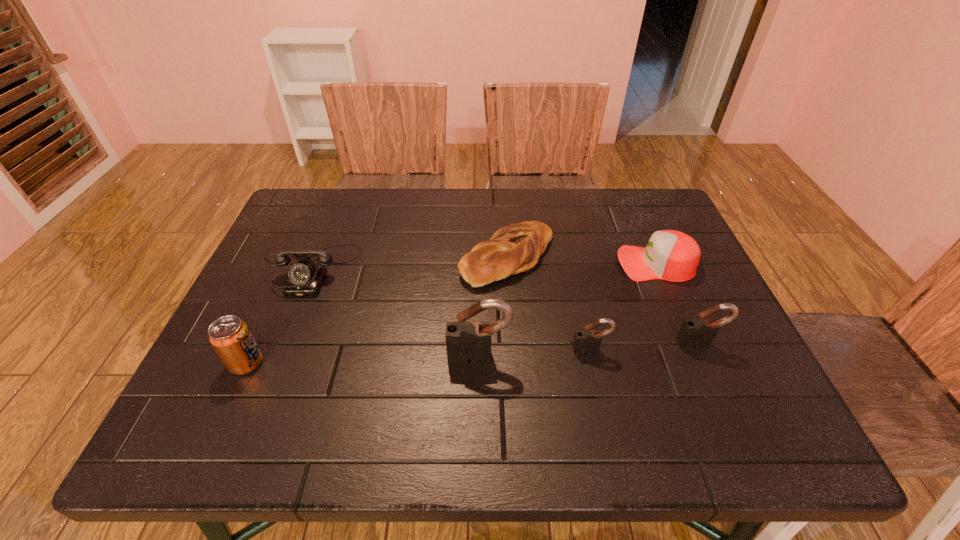
The width and height of the screenshot is (960, 540). In order to click on vacant region located with the keyhole on the front of the shortest padlock in this screenshot , I will do `click(603, 404)`.

This screenshot has height=540, width=960. What are the coordinates of `free point located with the keyhole on the front of the second shortest padlock` in the screenshot? It's located at (723, 397).

What are the coordinates of `vacant space located 0.070m on the front-facing side of the baseball cap` in the screenshot? It's located at (590, 264).

Identify the location of vacant space located on the front-facing side of the baseball cap. (x=598, y=264).

Image resolution: width=960 pixels, height=540 pixels. What are the coordinates of `vacant space situated on the front-facing side of the baseball cap` in the screenshot? It's located at tap(549, 264).

Identify the location of free region located on the left of the shortest object. (340, 256).

Find the location of a particular element. This screenshot has height=540, width=960. vacant area located 0.170m on the front-facing side of the telephone is located at coordinates (280, 355).

The height and width of the screenshot is (540, 960). Find the location of `vacant space located on the back of the soda can`. vacant space located on the back of the soda can is located at coordinates (302, 239).

Identify the location of object that is at the far edge. Image resolution: width=960 pixels, height=540 pixels. (516, 248).

The image size is (960, 540). Identify the location of object at the near edge. (230, 337).